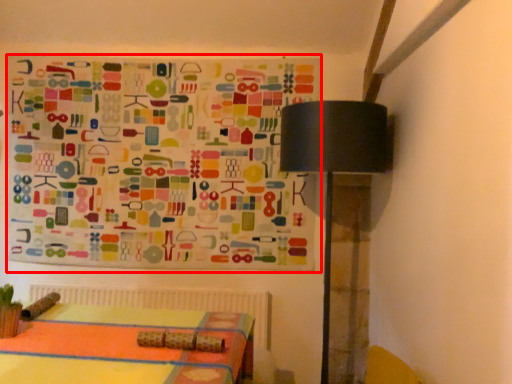
Question: From the image's perspective, what is the correct spatial positioning of bulletin board (annotated by the red box) in reference to table lamp?

Choices:
 (A) below
 (B) above

Answer: (B)